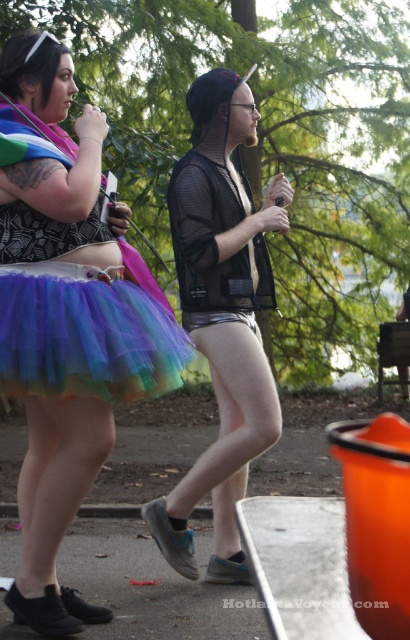
Question: Is mesh fabric jacket at center thinner than rainbow tulle skirt at lower left?

Choices:
 (A) no
 (B) yes

Answer: (B)

Question: Which point appears farthest from the camera in this image?

Choices:
 (A) (73, 316)
 (B) (236, 332)

Answer: (B)

Question: Which point is closer to the camera?

Choices:
 (A) (268, 202)
 (B) (18, 330)
 (C) (93, 275)

Answer: (B)

Question: Which point is closer to the camera?

Choices:
 (A) rainbow tulle skirt at left
 (B) rainbow tulle skirt at lower left
 (C) mesh fabric jacket at center

Answer: (B)

Question: Is mesh fabric jacket at center thinner than rainbow tulle skirt at lower left?

Choices:
 (A) yes
 (B) no

Answer: (A)

Question: Is rainbow tulle skirt at left bigger than rainbow tulle skirt at lower left?

Choices:
 (A) yes
 (B) no

Answer: (A)